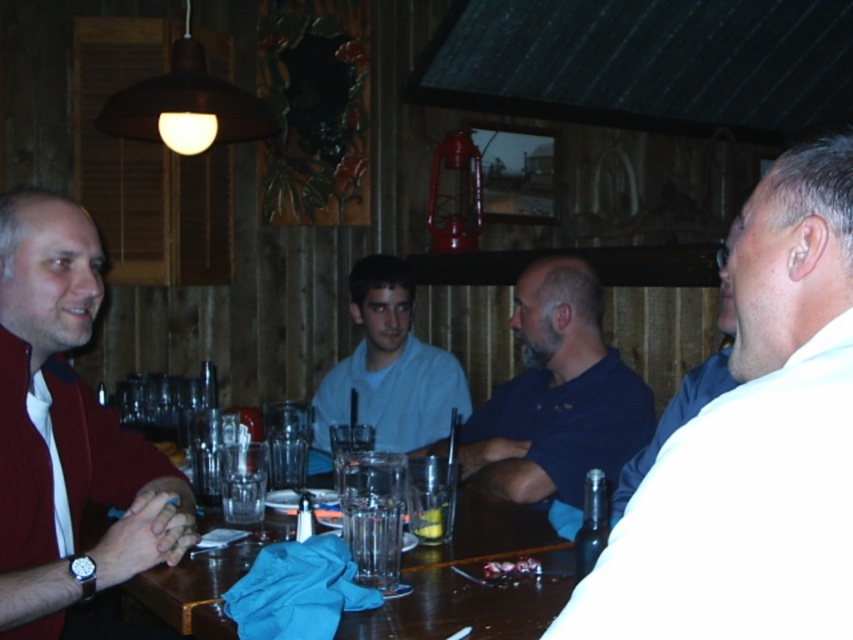
You are a server in a rustic bar. You need to deliver a drink to the transparent glass at table center. The customer wearing the matte red jacket at left is waving urgently. Can you reach the glass from where the jacket is without moving the jacket?

The distance between the matte red jacket at left and the transparent glass at table center is 16.80 inches, so yes, you can reach the glass from the jacket without moving it.